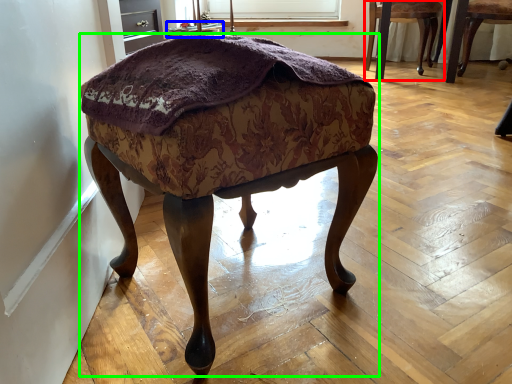
Question: Estimate the real-world distances between objects in this image. Which object is farther from chair (highlighted by a red box), side table (highlighted by a blue box) or stool (highlighted by a green box)?

Choices:
 (A) side table
 (B) stool

Answer: (B)